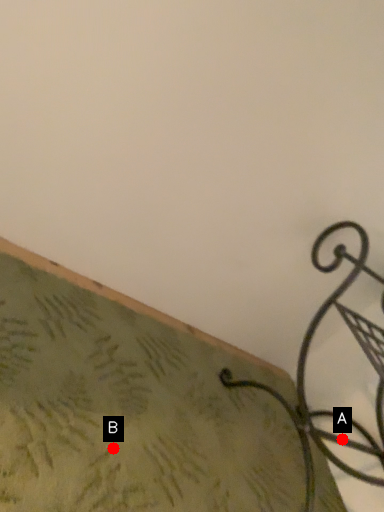
Question: Two points are circled on the image, labeled by A and B beside each circle. Which point is closer to the camera?

Choices:
 (A) A is closer
 (B) B is closer

Answer: (B)